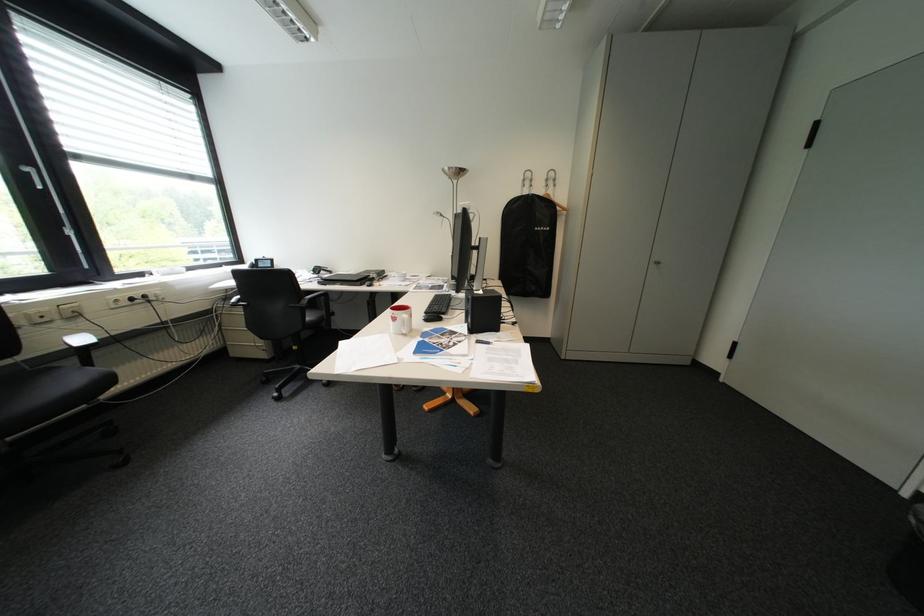
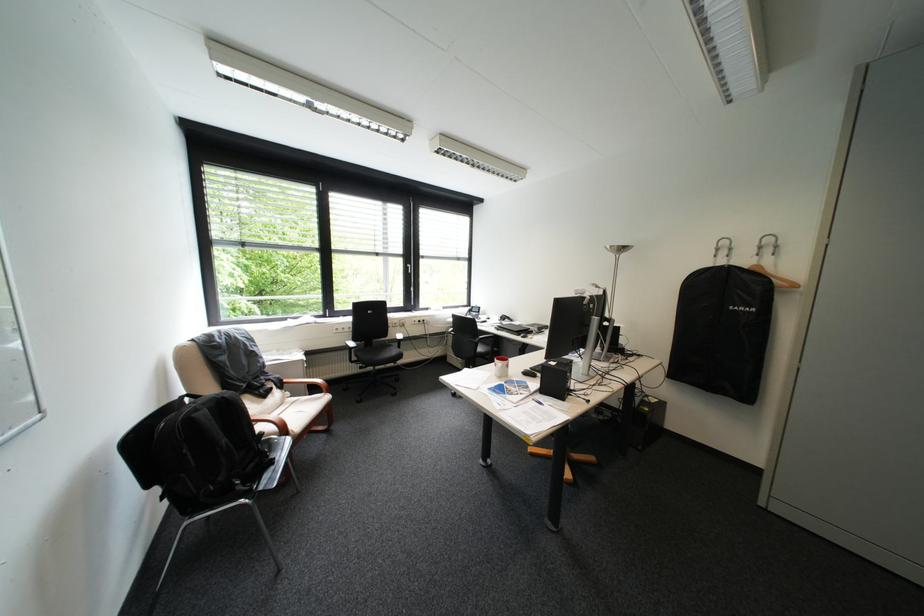
Locate, in the second image, the point that corresponds to (x=535, y=177) in the first image.

(727, 246)